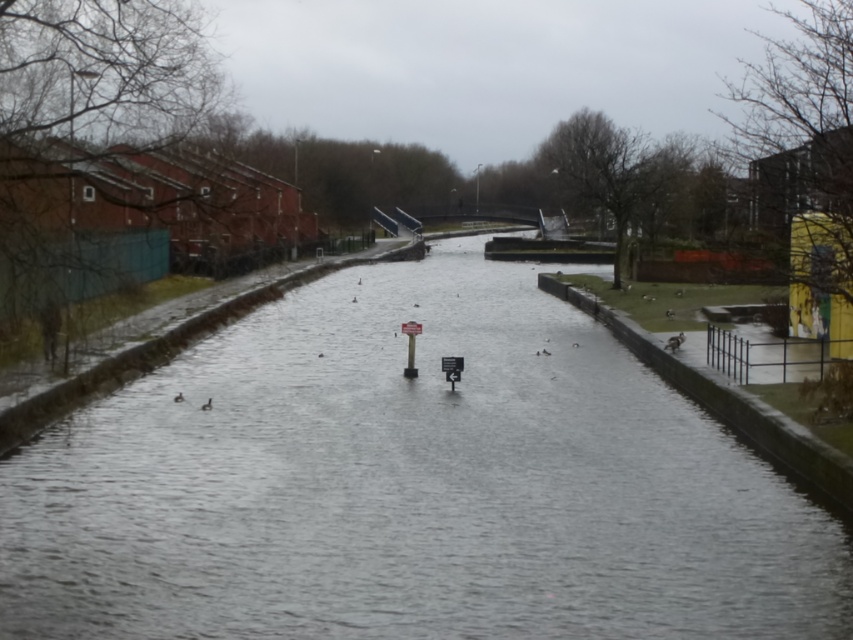
Question: Estimate the real-world distances between objects in this image. Which object is closer to the smooth concrete canal at center?

Choices:
 (A) metallic gray signpost at center
 (B) metallic street sign at center

Answer: (A)

Question: Is smooth concrete canal at center to the left of metallic gray signpost at center from the viewer's perspective?

Choices:
 (A) yes
 (B) no

Answer: (A)

Question: Which point is closer to the camera?

Choices:
 (A) metallic gray signpost at center
 (B) metallic street sign at center
 (C) smooth concrete canal at center

Answer: (C)

Question: Does metallic street sign at center appear under metallic gray signpost at center?

Choices:
 (A) no
 (B) yes

Answer: (A)

Question: Which of the following is the closest to the observer?

Choices:
 (A) smooth concrete canal at center
 (B) metallic street sign at center
 (C) metallic gray signpost at center

Answer: (A)

Question: Is smooth concrete canal at center below metallic gray signpost at center?

Choices:
 (A) no
 (B) yes

Answer: (B)